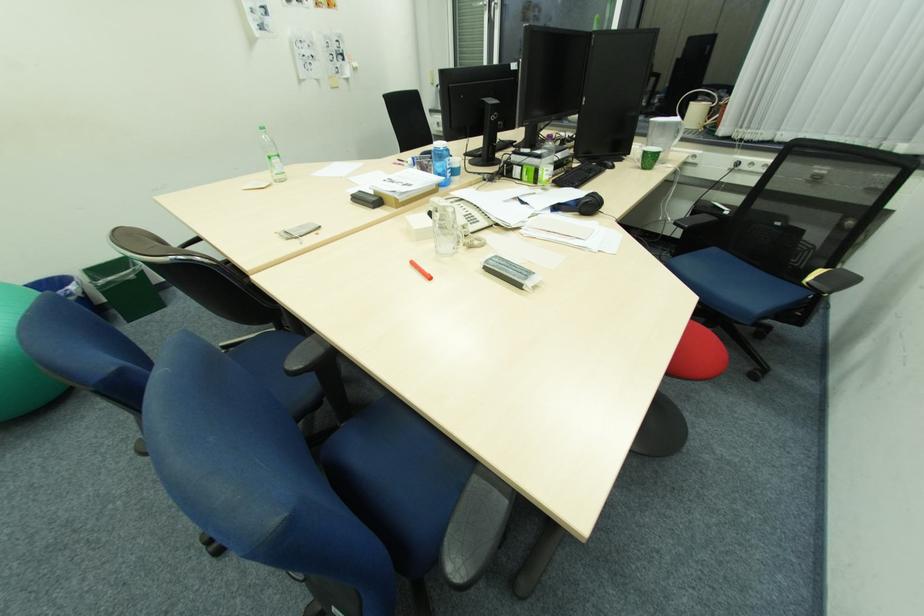
The width and height of the screenshot is (924, 616). Describe the element at coordinates (451, 211) in the screenshot. I see `the telephone handset` at that location.